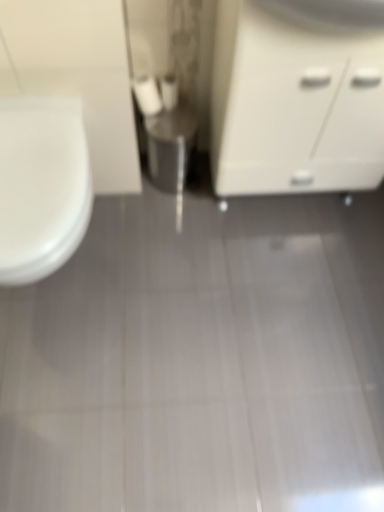
Identify the location of empty space that is to the right of white glossy toilet at left. (170, 278).